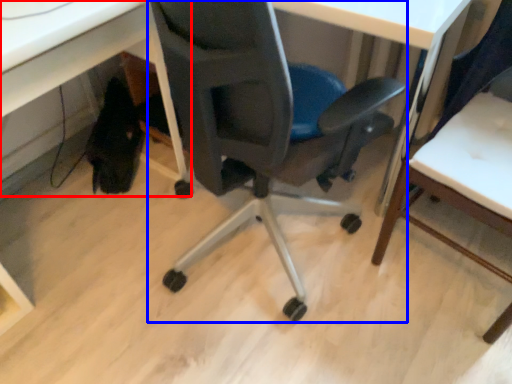
Question: Which of the following is the closest to the observer, computer desk (highlighted by a red box) or chair (highlighted by a blue box)?

Choices:
 (A) computer desk
 (B) chair

Answer: (A)